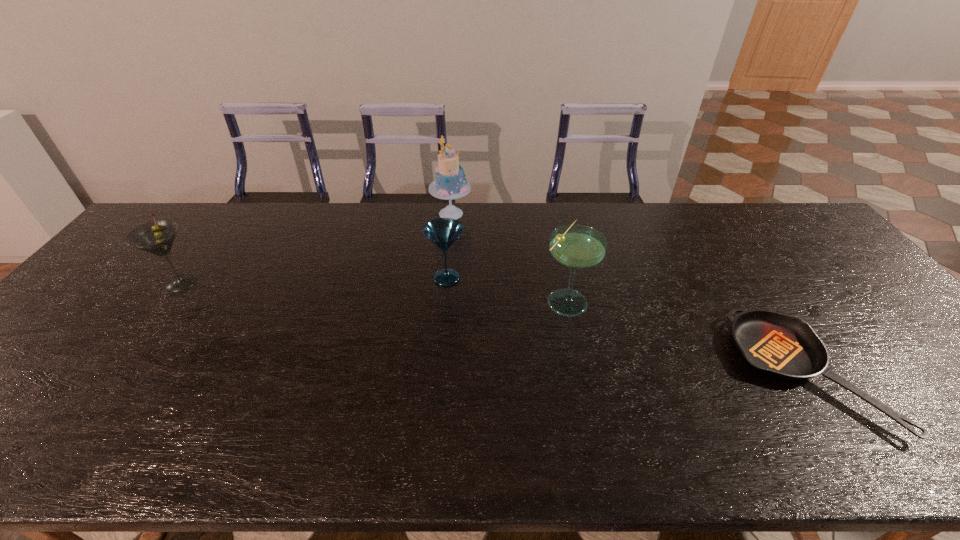
The image size is (960, 540). I want to click on the tallest object, so click(450, 183).

This screenshot has width=960, height=540. Identify the location of cake. (450, 183).

The width and height of the screenshot is (960, 540). In order to click on the fourth object from left to right in this screenshot , I will do `click(578, 247)`.

At what (x,y) coordinates should I click in order to perform the action: click on the leftmost object. Please return your answer as a coordinate pair (x, y). The width and height of the screenshot is (960, 540). Looking at the image, I should click on (157, 237).

You are a GUI agent. You are given a task and a screenshot of the screen. Output one action in this format:
    pyautogui.click(x=<x>, y=<y>)
    Task: Click on the second martini from right to left
    The image size is (960, 540).
    Given the screenshot: What is the action you would take?
    pyautogui.click(x=443, y=232)

The image size is (960, 540). I want to click on the fourth tallest object, so click(443, 232).

The height and width of the screenshot is (540, 960). Identify the location of frying pan. (783, 346).

At what (x,y) coordinates should I click in order to perform the action: click on the shortest object. Please return your answer as a coordinate pair (x, y). Looking at the image, I should click on (783, 346).

You are a GUI agent. You are given a task and a screenshot of the screen. Output one action in this format:
    pyautogui.click(x=<x>, y=<y>)
    Task: Click on the vacant space located 0.240m with a ladder on the side of the tallest object
    
    Given the screenshot: What is the action you would take?
    pyautogui.click(x=540, y=213)

This screenshot has width=960, height=540. What are the coordinates of `vacant space located 0.180m on the back of the second object from right to left` in the screenshot? It's located at (554, 241).